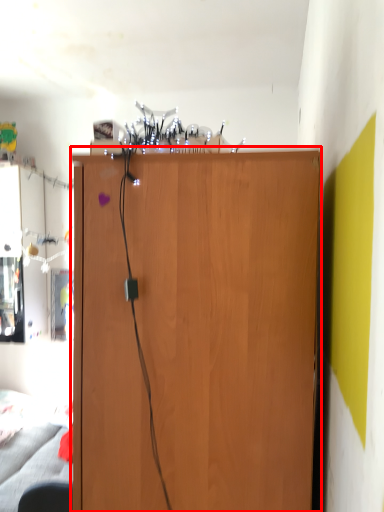
Question: From the image's perspective, where is cupboard (annotated by the red box) located relative to swivel chair?

Choices:
 (A) below
 (B) above

Answer: (B)